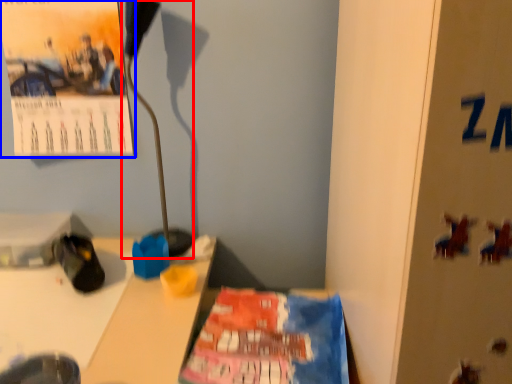
Question: Which point is further to the camera, lamp (highlighted by a red box) or poster (highlighted by a blue box)?

Choices:
 (A) lamp
 (B) poster

Answer: (B)